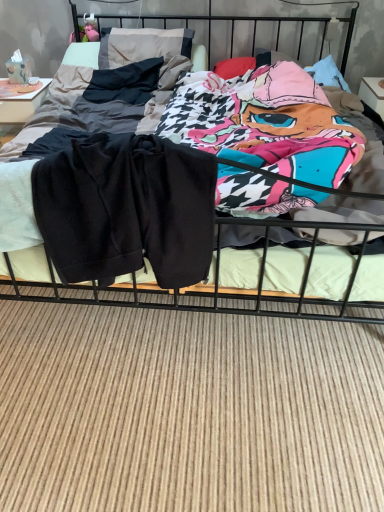
At what (x,y) coordinates should I click in order to perform the action: click on black cotton shorts at center. Please return your answer as a coordinate pair (x, y). Looking at the image, I should click on coord(35,32).

From the picture: Measure the distance between point (154, 270) and camera.

The depth of point (154, 270) is 1.28 meters.

I want to click on black cotton shorts at center, so click(x=35, y=32).

Is dark gray fabric pillow at upper left wider than black fleece shorts at center?

No.

Which is in front, point (150, 49) or point (114, 212)?

The point (114, 212) is in front.

Does dark gray fabric pillow at upper left come behind black fleece shorts at center?

Yes, dark gray fabric pillow at upper left is behind black fleece shorts at center.

Are dark gray fabric pillow at upper left and black fleece shorts at center far apart?

Indeed, dark gray fabric pillow at upper left is not near black fleece shorts at center.

Which object is positioned more to the right, black fleece shorts at center or black cotton shorts at center?

black cotton shorts at center.

From the image's perspective, does black fleece shorts at center appear higher than black cotton shorts at center?

No, from the image's perspective, black fleece shorts at center is not above black cotton shorts at center.

Is point (148, 139) positioned before point (383, 0)?

Yes, it is.

Does black fleece shorts at center have a smaller size compared to black cotton shorts at center?

Indeed, black fleece shorts at center has a smaller size compared to black cotton shorts at center.

Would you say black cotton shorts at center is a long distance from dark gray fabric pillow at upper left?

That's not correct — black cotton shorts at center is a little close to dark gray fabric pillow at upper left.

Can you confirm if black cotton shorts at center is thinner than dark gray fabric pillow at upper left?

Incorrect, the width of black cotton shorts at center is not less than that of dark gray fabric pillow at upper left.

Which point is more distant from viewer, (58, 51) or (120, 57)?

Positioned behind is point (58, 51).

Can you tell me how much black cotton shorts at center and dark gray fabric pillow at upper left differ in facing direction?

The angular difference between black cotton shorts at center and dark gray fabric pillow at upper left is 0.795 degrees.

Which object is closer to the camera, black cotton shorts at center or black fleece shorts at center?

Positioned in front is black cotton shorts at center.

Who is bigger, black cotton shorts at center or black fleece shorts at center?

Bigger between the two is black cotton shorts at center.

Is black cotton shorts at center not close to black fleece shorts at center?

Indeed, black cotton shorts at center is not near black fleece shorts at center.

Is point (371, 73) behind point (50, 159)?

Yes.

Is dark gray fabric pillow at upper left to the right of black cotton shorts at center from the viewer's perspective?

Incorrect, dark gray fabric pillow at upper left is not on the right side of black cotton shorts at center.

From the picture: Is dark gray fabric pillow at upper left positioned behind black cotton shorts at center?

Yes, it is.

Could you tell me if dark gray fabric pillow at upper left is turned towards black cotton shorts at center?

Yes, dark gray fabric pillow at upper left is turned towards black cotton shorts at center.

Based on the photo, is there a large distance between black fleece shorts at center and dark gray fabric pillow at upper left?

Yes, black fleece shorts at center is far from dark gray fabric pillow at upper left.

Measure the distance between black fleece shorts at center and dark gray fabric pillow at upper left.

5.02 feet.

In terms of height, does black fleece shorts at center look taller or shorter compared to dark gray fabric pillow at upper left?

In the image, black fleece shorts at center appears to be shorter than dark gray fabric pillow at upper left.

Looking at their sizes, would you say black fleece shorts at center is wider or thinner than dark gray fabric pillow at upper left?

Clearly, black fleece shorts at center has more width compared to dark gray fabric pillow at upper left.

What are the coordinates of `baby clothe in front of the dark gray fabric pillow at upper left` in the screenshot? It's located at (127, 209).

Identify the location of baby clothe that is behind the black cotton shorts at center. (127, 209).

Based on their spatial positions, is black cotton shorts at center or black fleece shorts at center further from dark gray fabric pillow at upper left?

black fleece shorts at center is positioned further to the anchor dark gray fabric pillow at upper left.

In the scene shown: Which object lies nearer to the anchor point black fleece shorts at center, dark gray fabric pillow at upper left or black cotton shorts at center?

dark gray fabric pillow at upper left is positioned closer to the anchor black fleece shorts at center.

Estimate the real-world distances between objects in this image. Which object is further from dark gray fabric pillow at upper left, black fleece shorts at center or black cotton shorts at center?

black fleece shorts at center is positioned further to the anchor dark gray fabric pillow at upper left.

When comparing their distances from black cotton shorts at center, does black fleece shorts at center or dark gray fabric pillow at upper left seem further?

Among the two, black fleece shorts at center is located further to black cotton shorts at center.

Which object lies nearer to the anchor point black cotton shorts at center, dark gray fabric pillow at upper left or black fleece shorts at center?

dark gray fabric pillow at upper left.

Considering their positions, is black cotton shorts at center positioned closer to black fleece shorts at center than dark gray fabric pillow at upper left?

dark gray fabric pillow at upper left lies closer to black fleece shorts at center than the other object.

At what (x,y) coordinates should I click in order to perform the action: click on baby clothe positioned between black cotton shorts at center and dark gray fabric pillow at upper left from near to far. Please return your answer as a coordinate pair (x, y). Looking at the image, I should click on (127, 209).